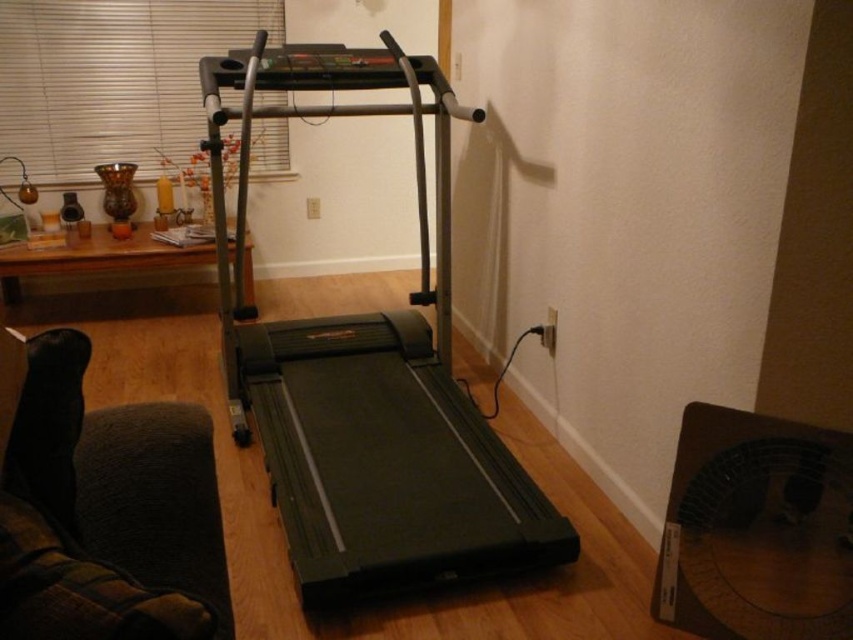
You are standing at the point marked by coordinates (368, 374) in the image. What object are you directly standing on?

The point marked by coordinates (368, 374) is directly on the black rubber treadmill at center.

Looking at this image, you are standing in the room and want to know which of the two points, point (259, 12) or point (82, 244), is closer to you. Based on the coordinates provided, can you determine which point is nearer?

Point (259, 12) is further to the camera than point (82, 244), so the point closer to you is point (82, 244).

You are standing in the room and want to turn on the black plastic fan at lower right. Where should you look to find it?

The black plastic fan at lower right is located at the 2D coordinates of point (756,529), so look towards the lower right area of the room to find it.